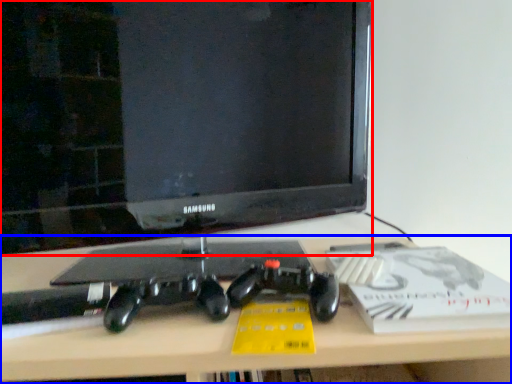
Question: Which of the following is the farthest to the observer, television (highlighted by a red box) or desk (highlighted by a blue box)?

Choices:
 (A) television
 (B) desk

Answer: (A)